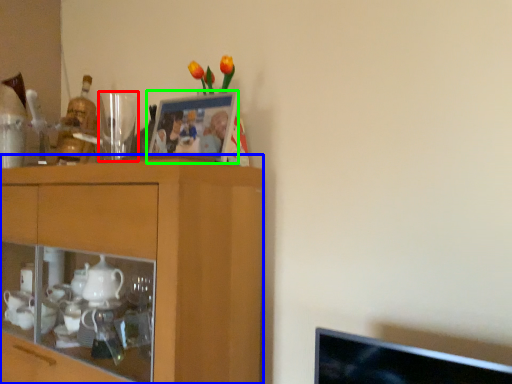
Question: Considering the real-world distances, which object is closest to tableware (highlighted by a red box)? cabinetry (highlighted by a blue box) or picture frame (highlighted by a green box).

Choices:
 (A) cabinetry
 (B) picture frame

Answer: (B)